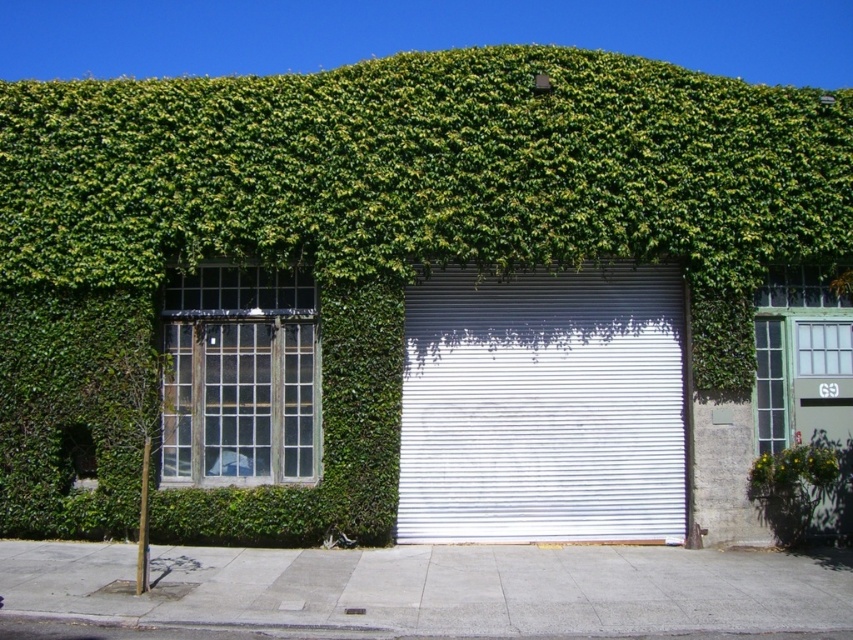
Question: Which object appears farthest from the camera in this image?

Choices:
 (A) green leafy plant at lower right
 (B) white metallic garage door at center

Answer: (B)

Question: Considering the relative positions of white metallic garage door at center and green leafy plant at lower right in the image provided, where is white metallic garage door at center located with respect to green leafy plant at lower right?

Choices:
 (A) left
 (B) right

Answer: (A)

Question: Which of the following is the farthest from the observer?

Choices:
 (A) (798, 444)
 (B) (498, 298)

Answer: (B)

Question: From the image, what is the correct spatial relationship of white metallic garage door at center in relation to green leafy plant at lower right?

Choices:
 (A) above
 (B) below

Answer: (A)

Question: Can you confirm if white metallic garage door at center is bigger than green leafy plant at lower right?

Choices:
 (A) no
 (B) yes

Answer: (B)